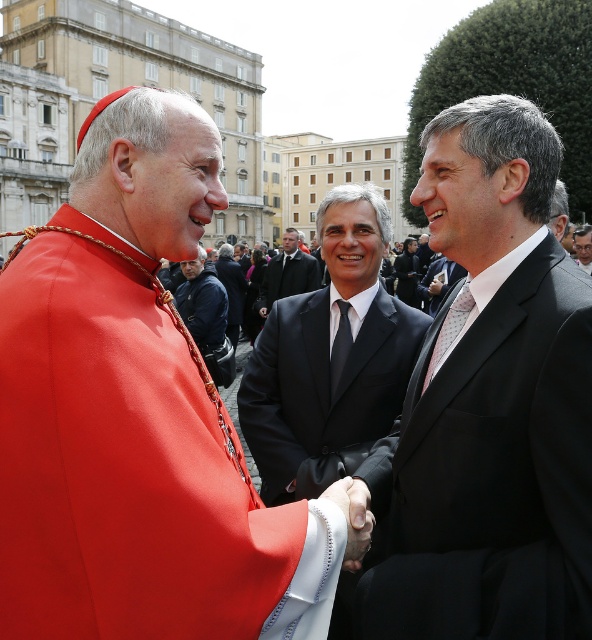
In the scene shown: Does dark gray suit at center appear on the right side of smooth black suit at center?

No, dark gray suit at center is not to the right of smooth black suit at center.

The image size is (592, 640). Identify the location of dark gray suit at center. (231, 289).

Which is above, matte red cassock at center or black satin suit at center?

black satin suit at center is higher up.

Can you confirm if matte red cassock at center is positioned to the left of black satin suit at center?

Yes, matte red cassock at center is to the left of black satin suit at center.

What do you see at coordinates (139, 419) in the screenshot? I see `matte red cassock at center` at bounding box center [139, 419].

What are the coordinates of `matte red cassock at center` in the screenshot? It's located at (139, 419).

Who is more distant from viewer, [89,616] or [236,301]?

The point [236,301] is more distant.

Is point (108, 268) more distant than point (230, 273)?

No.

You are a GUI agent. You are given a task and a screenshot of the screen. Output one action in this format:
    pyautogui.click(x=<x>, y=<y>)
    Task: Click on the matte red cassock at center
    The image size is (592, 640).
    Given the screenshot: What is the action you would take?
    pyautogui.click(x=139, y=419)